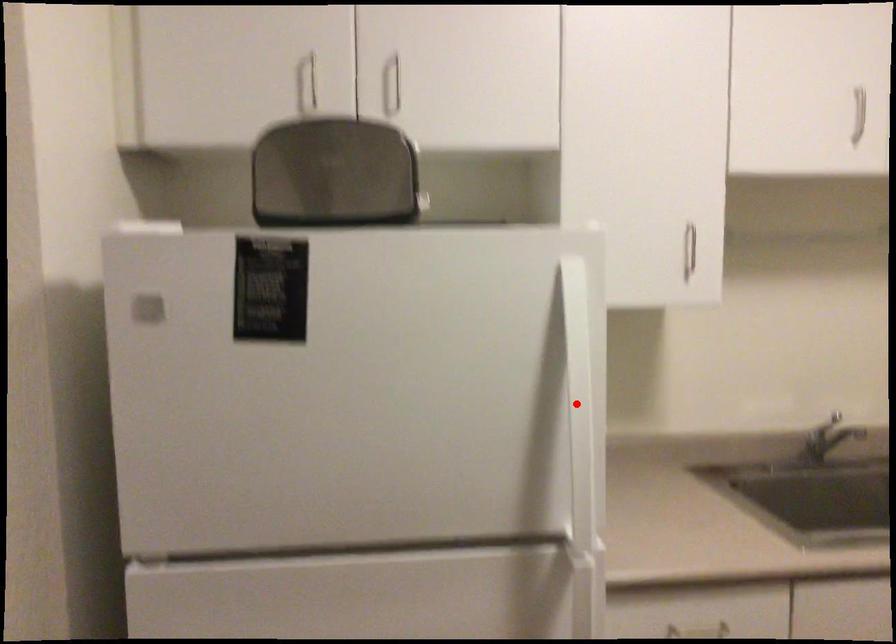
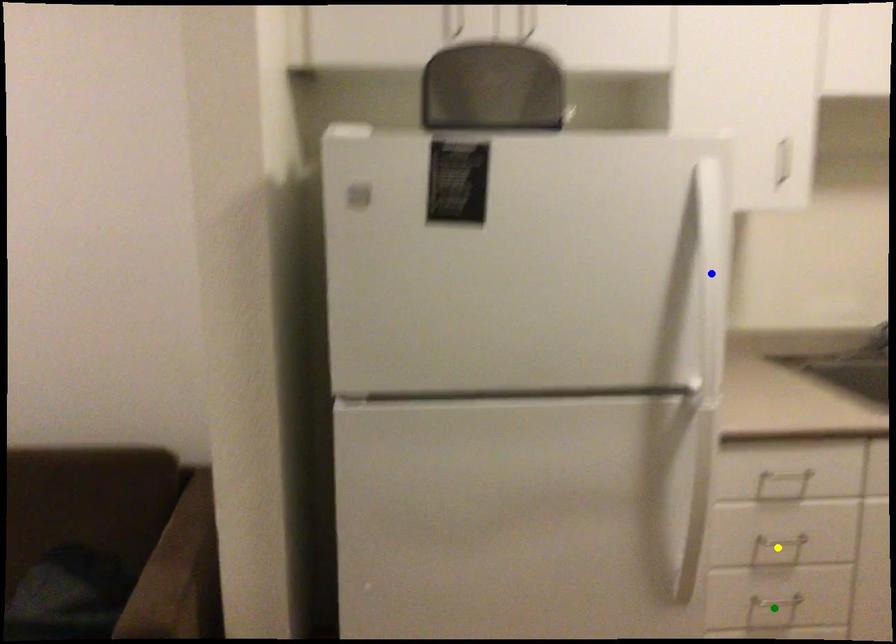
Question: I am providing you with two images of the same scene from different viewpoints. A red point is marked on the first image. You are given multiple points on the second image. Can you choose the point in image 2 that corresponds to the point in image 1?

Choices:
 (A) blue point
 (B) green point
 (C) yellow point

Answer: (A)